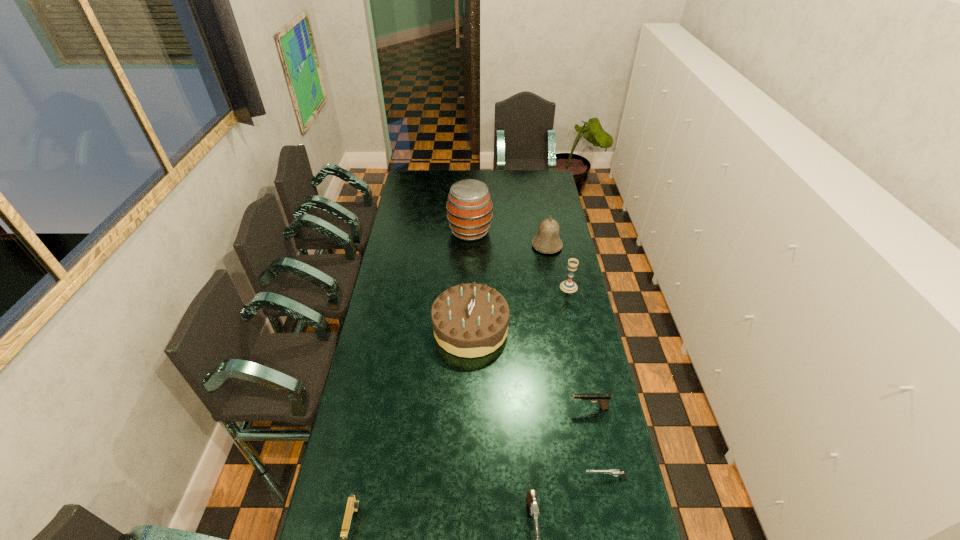
Identify the location of the tallest object. The width and height of the screenshot is (960, 540). (469, 207).

I want to click on bell, so click(x=547, y=240).

Find the location of a particular element. This screenshot has height=540, width=960. birthday cake is located at coordinates (470, 320).

The width and height of the screenshot is (960, 540). I want to click on chalice, so click(x=568, y=286).

The image size is (960, 540). In order to click on the fifth farthest object in this screenshot , I will do `click(603, 399)`.

Locate an element on the screen. the shortest pistol is located at coordinates (615, 472).

Find the location of `the third nearest object`. the third nearest object is located at coordinates (615, 472).

You are a GUI agent. You are given a task and a screenshot of the screen. Output one action in this format:
    pyautogui.click(x=<x>, y=<y>)
    Task: Click on the blank space located 0.130m on the back of the cider
    The height and width of the screenshot is (540, 960).
    Given the screenshot: What is the action you would take?
    pyautogui.click(x=470, y=205)

Image resolution: width=960 pixels, height=540 pixels. Identify the location of vacant region located on the front of the bell. (555, 293).

This screenshot has width=960, height=540. Find the location of `free spot located on the front-facing side of the birthday cake`. free spot located on the front-facing side of the birthday cake is located at coordinates (571, 328).